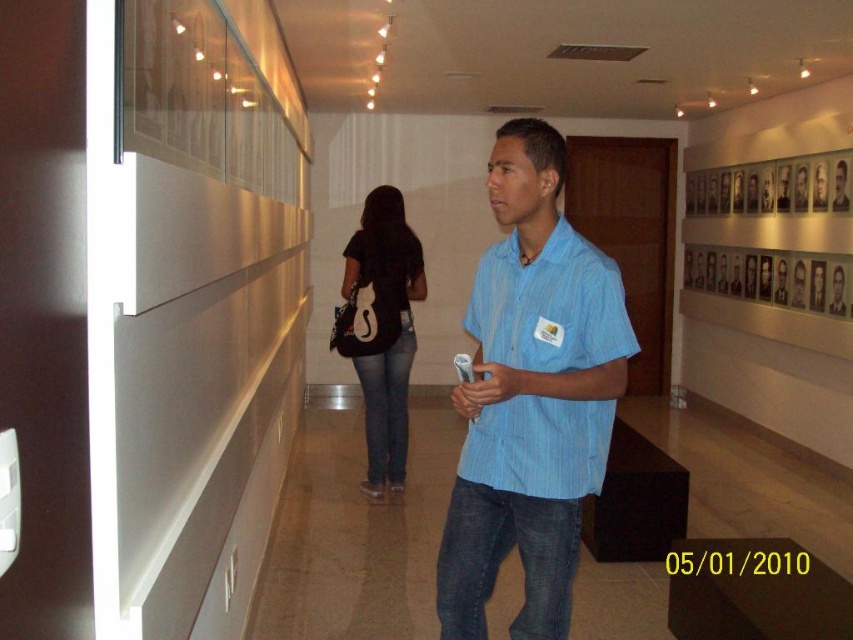
Can you confirm if denim at center is bigger than black matte shirt at center?

Incorrect, denim at center is not larger than black matte shirt at center.

I want to click on denim at center, so click(503, 557).

Locate an element on the screen. The height and width of the screenshot is (640, 853). denim at center is located at coordinates (503, 557).

Who is taller, denim at center or blue denim jeans at center?

Standing taller between the two is blue denim jeans at center.

Consider the image. Does denim at center come behind blue denim jeans at center?

No, it is not.

The height and width of the screenshot is (640, 853). What are the coordinates of `denim at center` in the screenshot? It's located at (503, 557).

The image size is (853, 640). I want to click on denim at center, so click(503, 557).

Is blue striped shirt at center above denim at center?

Yes.

Which is behind, point (531, 580) or point (529, 593)?

The point (529, 593) is behind.

I want to click on blue striped shirt at center, so click(x=531, y=396).